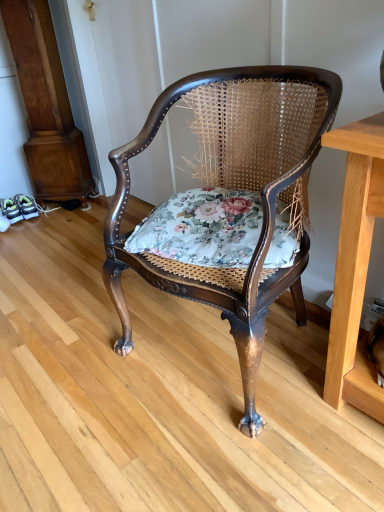
Question: Is floral fabric cushion at center in front of or behind polished wood chair at center in the image?

Choices:
 (A) behind
 (B) front

Answer: (A)

Question: Is point (289, 261) positioned closer to the camera than point (332, 112)?

Choices:
 (A) farther
 (B) closer

Answer: (A)

Question: From the image's perspective, is floral fabric cushion at center above or below polished wood chair at center?

Choices:
 (A) above
 (B) below

Answer: (A)

Question: From the image's perspective, is polished wood chair at center above or below floral fabric cushion at center?

Choices:
 (A) below
 (B) above

Answer: (A)

Question: In terms of size, does polished wood chair at center appear bigger or smaller than floral fabric cushion at center?

Choices:
 (A) big
 (B) small

Answer: (A)

Question: Is polished wood chair at center taller or shorter than floral fabric cushion at center?

Choices:
 (A) tall
 (B) short

Answer: (A)

Question: Looking at their shapes, would you say polished wood chair at center is wider or thinner than floral fabric cushion at center?

Choices:
 (A) wide
 (B) thin

Answer: (A)